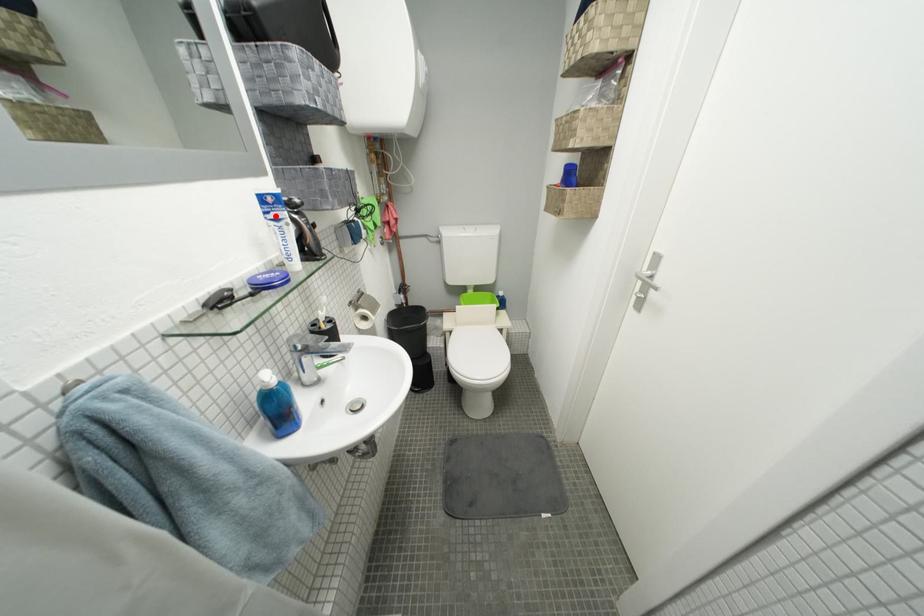
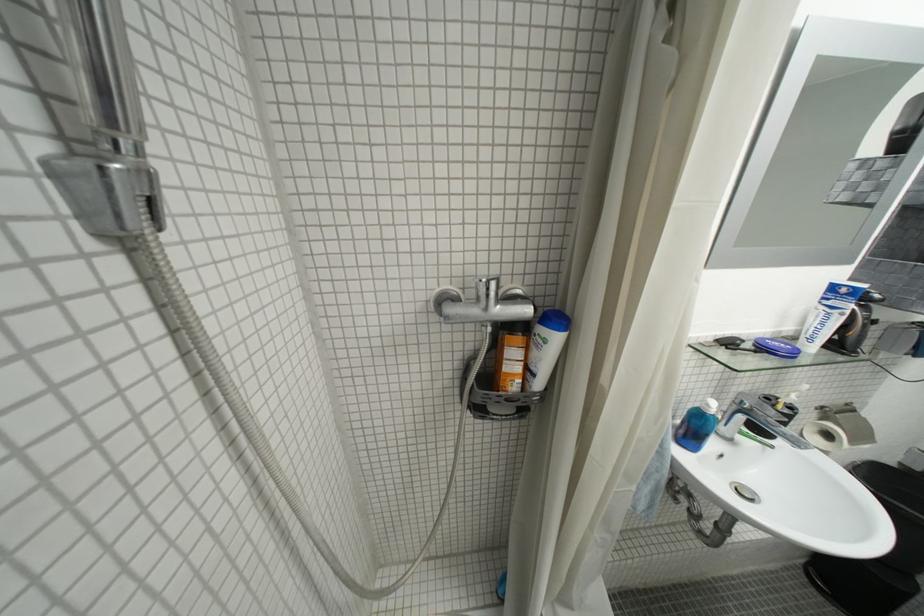
The point at the highlighted location is marked in the first image. Where is the corresponding point in the second image?

(833, 301)